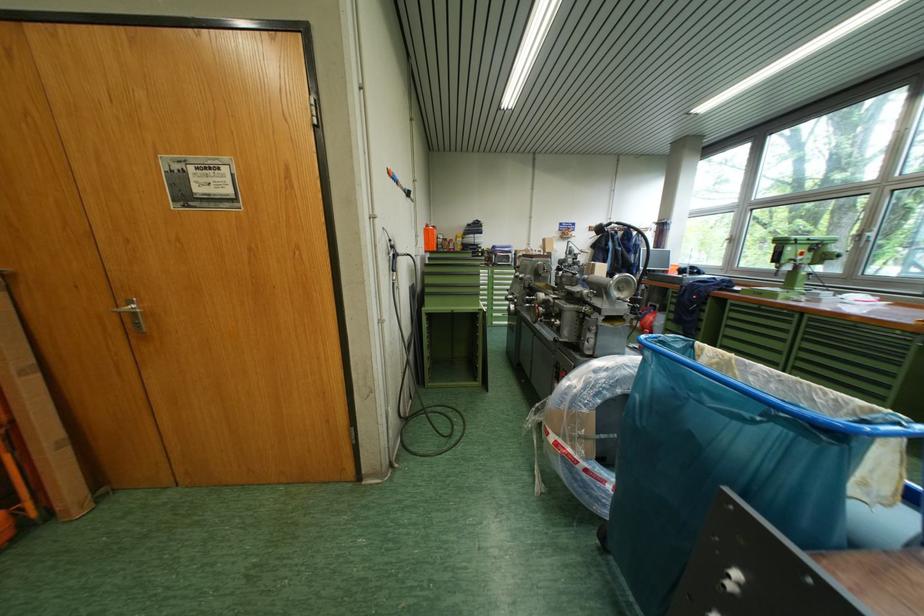
Find where to push the silver door handle. Please return your answer as a coordinate pair (x, y).

(130, 313)